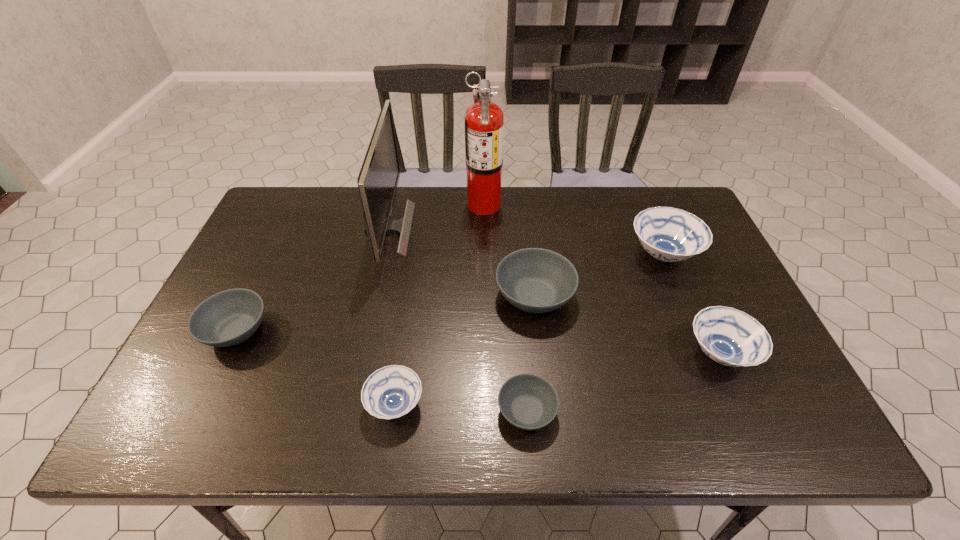
You are a GUI agent. You are given a task and a screenshot of the screen. Output one action in this format:
    pyautogui.click(x=<x>, y=<y>)
    Task: Click on the free point located on the right of the leftmost object
    The width and height of the screenshot is (960, 540).
    Given the screenshot: What is the action you would take?
    pyautogui.click(x=399, y=330)

Locate an element on the screen. free space located 0.110m on the right of the leftmost blue soup bowl is located at coordinates (475, 404).

Where is `free space located on the left of the nearest gray soup bowl`? The height and width of the screenshot is (540, 960). free space located on the left of the nearest gray soup bowl is located at coordinates (385, 411).

Identify the location of fire extinguisher located at the far edge. (484, 122).

This screenshot has height=540, width=960. I want to click on monitor that is at the far edge, so click(378, 179).

Where is `soup bowl that is positioned at the far edge`? The image size is (960, 540). soup bowl that is positioned at the far edge is located at coordinates (668, 234).

Locate an element on the screen. The image size is (960, 540). object positioned at the left edge is located at coordinates (230, 317).

You are a GUI agent. You are given a task and a screenshot of the screen. Output one action in this format:
    pyautogui.click(x=<x>, y=<y>)
    Task: Click on the object that is at the far right corner
    Image resolution: width=960 pixels, height=540 pixels.
    Given the screenshot: What is the action you would take?
    pyautogui.click(x=668, y=234)

This screenshot has width=960, height=540. In order to click on vacant space at the far edge of the desktop in this screenshot , I will do `click(591, 211)`.

The width and height of the screenshot is (960, 540). I want to click on vacant region at the near edge of the desktop, so click(637, 442).